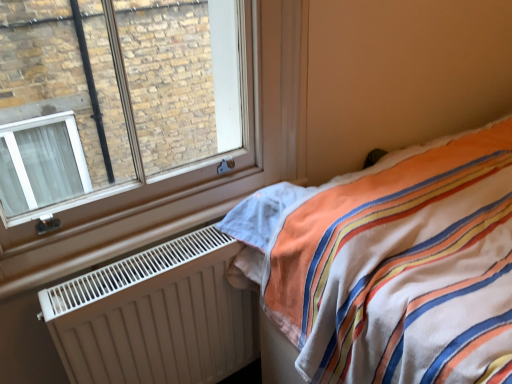
Question: From a real-world perspective, is clear glass window at upper left beneath striped cotton bed at right?

Choices:
 (A) no
 (B) yes

Answer: (A)

Question: Is striped cotton bed at right surrounded by clear glass window at upper left?

Choices:
 (A) yes
 (B) no

Answer: (B)

Question: Is clear glass window at upper left closer to camera compared to striped cotton bed at right?

Choices:
 (A) no
 (B) yes

Answer: (A)

Question: Is clear glass window at upper left not within striped cotton bed at right?

Choices:
 (A) no
 (B) yes

Answer: (B)

Question: Is the position of clear glass window at upper left more distant than that of striped cotton bed at right?

Choices:
 (A) no
 (B) yes

Answer: (B)

Question: From a real-world perspective, is striped cotton bed at right above or below white matte radiator at lower left?

Choices:
 (A) above
 (B) below

Answer: (A)

Question: Considering the relative positions of striped cotton bed at right and white matte radiator at lower left in the image provided, is striped cotton bed at right to the left or to the right of white matte radiator at lower left?

Choices:
 (A) right
 (B) left

Answer: (A)

Question: Considering the positions of point (458, 139) and point (67, 294), is point (458, 139) closer or farther from the camera than point (67, 294)?

Choices:
 (A) closer
 (B) farther

Answer: (B)

Question: In terms of width, does striped cotton bed at right look wider or thinner when compared to white matte radiator at lower left?

Choices:
 (A) thin
 (B) wide

Answer: (B)

Question: Choose the correct answer: Is white matte radiator at lower left inside clear glass window at upper left or outside it?

Choices:
 (A) inside
 (B) outside

Answer: (B)

Question: From the image's perspective, is white matte radiator at lower left located above or below clear glass window at upper left?

Choices:
 (A) above
 (B) below

Answer: (B)

Question: In terms of width, does white matte radiator at lower left look wider or thinner when compared to clear glass window at upper left?

Choices:
 (A) thin
 (B) wide

Answer: (B)

Question: Is white matte radiator at lower left bigger or smaller than clear glass window at upper left?

Choices:
 (A) big
 (B) small

Answer: (B)

Question: From a real-world perspective, is clear glass window at upper left above or below white matte radiator at lower left?

Choices:
 (A) below
 (B) above

Answer: (B)

Question: In the image, is clear glass window at upper left positioned in front of or behind white matte radiator at lower left?

Choices:
 (A) behind
 (B) front

Answer: (B)